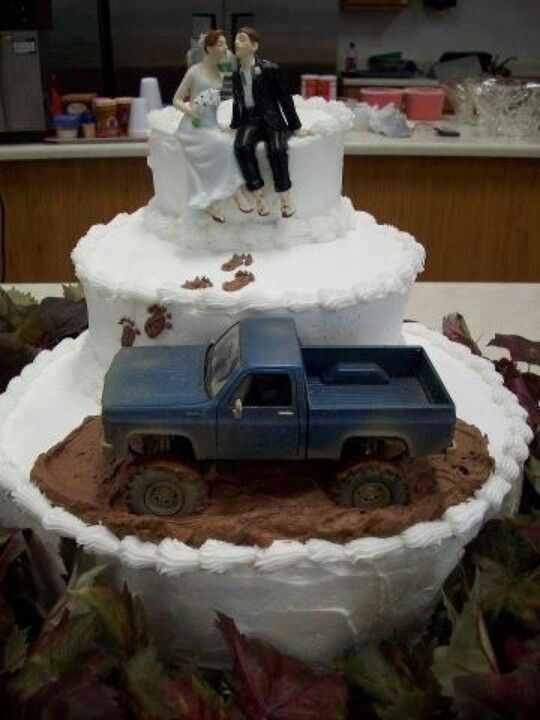
At what (x,y) coordinates should I click in order to perform the action: click on counter top. Please return your answer as a coordinate pair (x, y). This screenshot has width=540, height=720. Looking at the image, I should click on (426, 144).